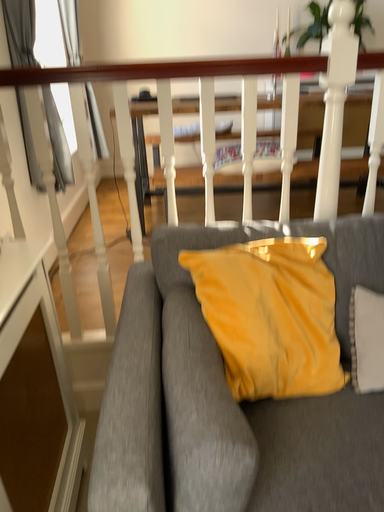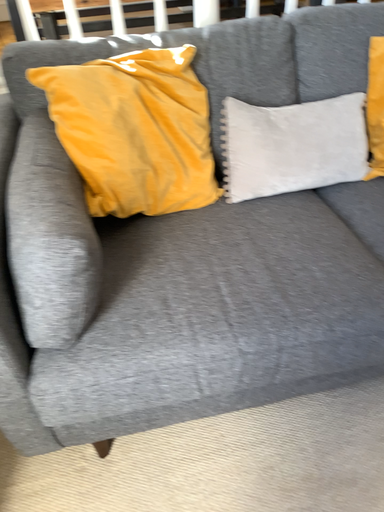
Question: Which way did the camera rotate in the video?

Choices:
 (A) rotated right
 (B) rotated left

Answer: (A)